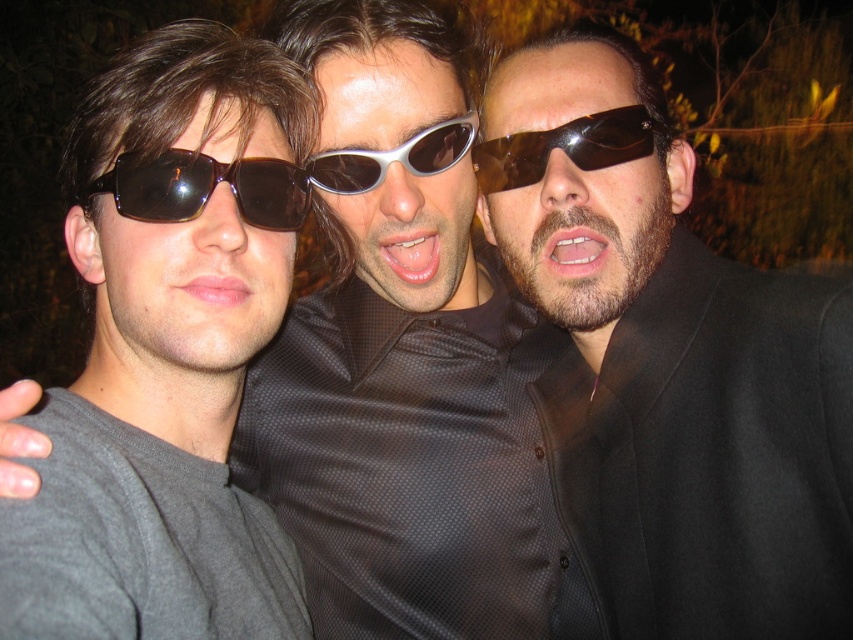
Between matte black suit at center and matte black sunglasses at left, which one is positioned lower?

matte black sunglasses at left is below.

What do you see at coordinates (688, 406) in the screenshot? Image resolution: width=853 pixels, height=640 pixels. I see `matte black suit at center` at bounding box center [688, 406].

Identify the location of matte black suit at center. The height and width of the screenshot is (640, 853). (688, 406).

Does point (16, 634) lie behind point (642, 129)?

No, (16, 634) is in front of (642, 129).

Does matte black sunglasses at left have a greater width compared to brown matte sunglasses at center?

Correct, the width of matte black sunglasses at left exceeds that of brown matte sunglasses at center.

Does point (193, 566) come behind point (573, 145)?

That is False.

You are a GUI agent. You are given a task and a screenshot of the screen. Output one action in this format:
    pyautogui.click(x=<x>, y=<y>)
    Task: Click on the matte black sunglasses at left
    This screenshot has height=640, width=853.
    Given the screenshot: What is the action you would take?
    pyautogui.click(x=155, y=444)

Between point (117, 602) and point (152, 170), which one is positioned behind?

Positioned behind is point (152, 170).

Does matte black sunglasses at left have a lesser width compared to matte brown sunglasses at left?

No.

Is point (283, 93) positioned in front of point (173, 156)?

No, it is not.

The height and width of the screenshot is (640, 853). I want to click on matte black sunglasses at left, so click(x=155, y=444).